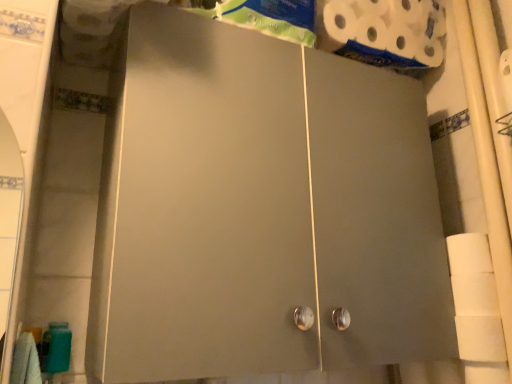
Question: From a real-world perspective, is white matte toilet paper at right, acting as the first toilet paper starting from the front, above or below white matte toilet paper at upper right, acting as the first toilet paper starting from the back?

Choices:
 (A) below
 (B) above

Answer: (A)

Question: Is white matte toilet paper at right, which appears as the 2th toilet paper when viewed from the back, in front of or behind white matte toilet paper at upper right, acting as the first toilet paper starting from the back, in the image?

Choices:
 (A) front
 (B) behind

Answer: (A)

Question: Estimate the real-world distances between objects in this image. Which object is farther from the white matte toilet paper at upper right, which appears as the second toilet paper when viewed from the front?

Choices:
 (A) matte gray cabinet at center
 (B) white matte toilet paper at right, positioned as the 1th toilet paper in bottom-to-top order

Answer: (B)

Question: Considering the real-world distances, which object is closest to the matte gray cabinet at center?

Choices:
 (A) white matte toilet paper at right, positioned as the 1th toilet paper in bottom-to-top order
 (B) white matte toilet paper at upper right, which appears as the second toilet paper when viewed from the front

Answer: (A)